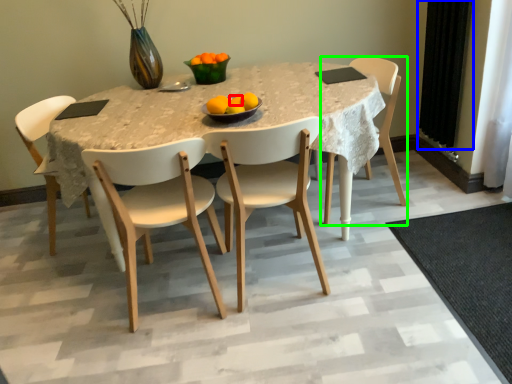
Question: Estimate the real-world distances between objects in this image. Which object is closer to orange (highlighted by a red box), curtain (highlighted by a blue box) or chair (highlighted by a green box)?

Choices:
 (A) curtain
 (B) chair

Answer: (B)